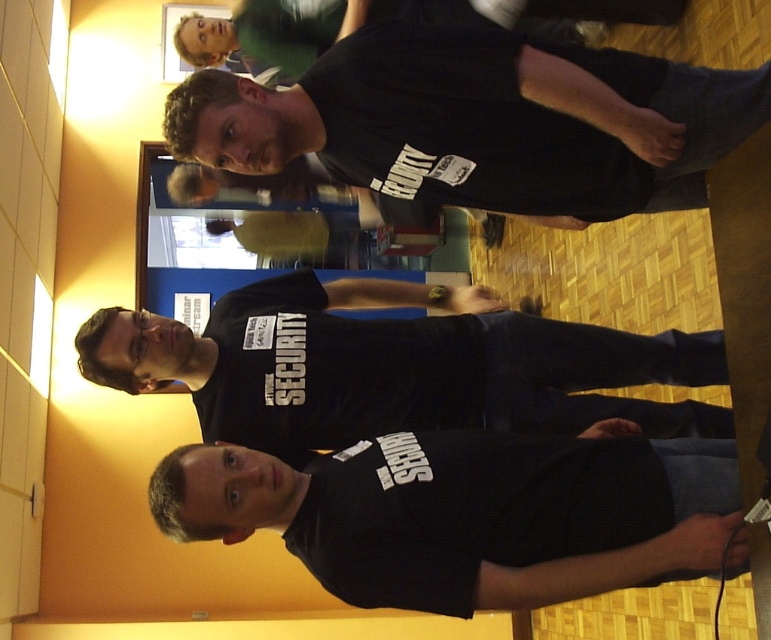
You are organizing a photo shoot and need to ensure that the black matte shirt at lower center and the black matte security shirt at center are visible in the final image. Given their sizes, which one might you need to position closer to the camera to ensure visibility?

The black matte shirt at lower center occupies less space than the black matte security shirt at center, so positioning it closer to the camera would help ensure its visibility.

You are a photographer setting up a shoot in this scene. You want to ensure that both the black matte shirt at lower center and the black matte security shirt at center are clearly visible in the photo. Given their positions, which shirt should you focus on first to ensure both are in focus?

The black matte shirt at lower center is positioned under the black matte security shirt at center. To ensure both are in focus, you should focus on the black matte security shirt at center first since it is closer to the camera, and the shirt below it may fall out of focus if not properly framed.